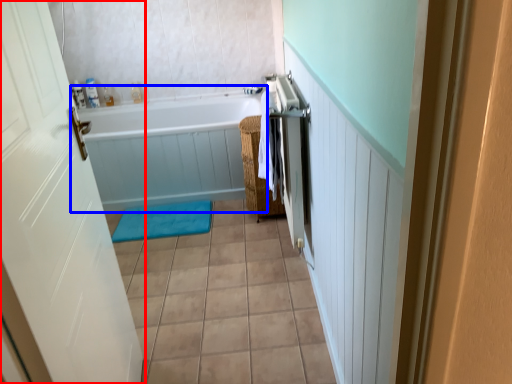
Question: Among these objects, which one is farthest to the camera, door (highlighted by a red box) or bathtub (highlighted by a blue box)?

Choices:
 (A) door
 (B) bathtub

Answer: (B)